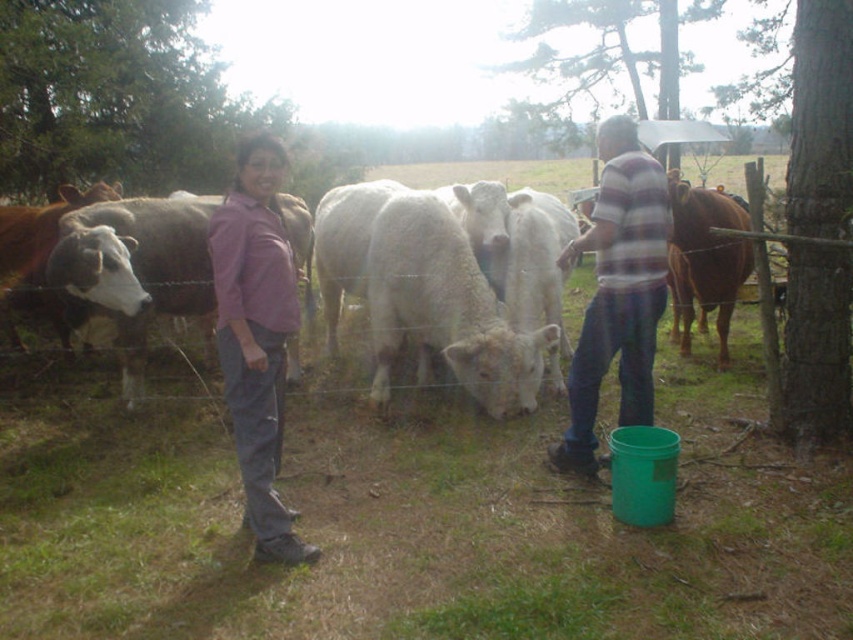
Can you confirm if purple cotton shirt at center is shorter than brown glossy cow at right?

In fact, purple cotton shirt at center may be taller than brown glossy cow at right.

Between purple cotton shirt at center and brown glossy cow at right, which one is positioned lower?

purple cotton shirt at center is lower down.

Who is more forward, (264,195) or (689,196)?

Point (264,195) is in front.

Where is `purple cotton shirt at center`? The width and height of the screenshot is (853, 640). purple cotton shirt at center is located at coordinates (257, 337).